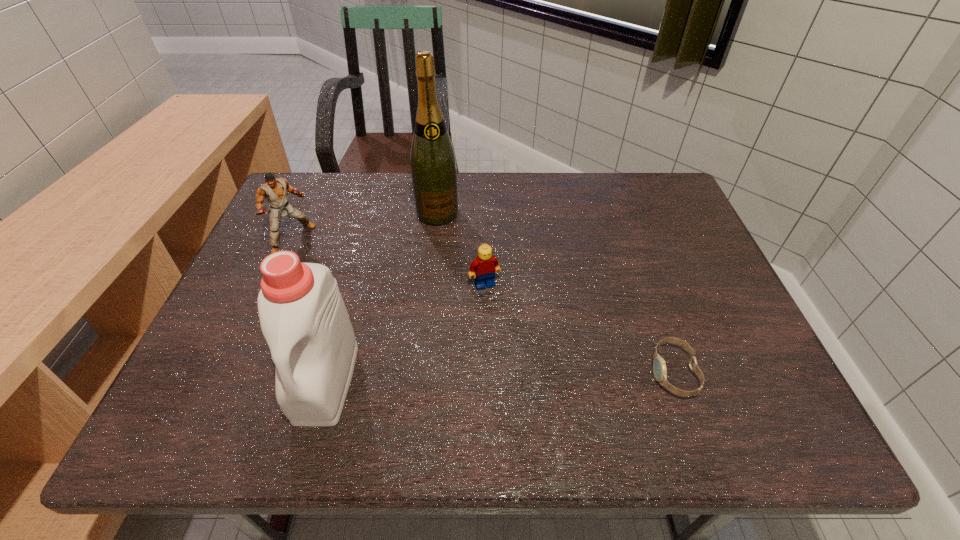
Identify the location of blank space located on the face of the rightmost object. Image resolution: width=960 pixels, height=540 pixels. (550, 373).

Where is `blank area located 0.280m on the face of the rightmost object`? blank area located 0.280m on the face of the rightmost object is located at coordinates (516, 373).

Image resolution: width=960 pixels, height=540 pixels. In order to click on free location located on the face of the rightmost object in this screenshot , I will do `click(628, 373)`.

This screenshot has width=960, height=540. Identify the location of vacant space located 0.200m on the front-facing side of the tallest object. (456, 276).

Identify the location of blank area located 0.390m on the front-facing side of the tallest object. (473, 336).

The image size is (960, 540). Find the location of `free space located 0.310m on the front-facing side of the tallest object`. free space located 0.310m on the front-facing side of the tallest object is located at coordinates (466, 309).

The width and height of the screenshot is (960, 540). What are the coordinates of `vacant space located 0.300m on the front-facing side of the puncher` in the screenshot? It's located at (378, 309).

Find the location of a particular element. Image resolution: width=960 pixels, height=540 pixels. blank space located on the front-facing side of the puncher is located at coordinates (326, 269).

Locate an element on the screen. The width and height of the screenshot is (960, 540). free space located on the front-facing side of the puncher is located at coordinates (324, 268).

Find the location of a particular element. The height and width of the screenshot is (540, 960). vacant space located 0.070m on the front-facing side of the fourth object from left to right is located at coordinates (499, 312).